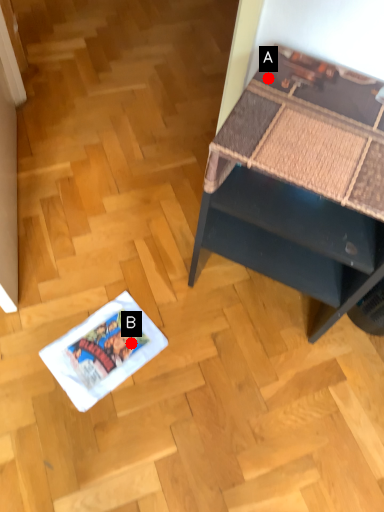
Question: Two points are circled on the image, labeled by A and B beside each circle. Which point is closer to the camera?

Choices:
 (A) A is closer
 (B) B is closer

Answer: (A)